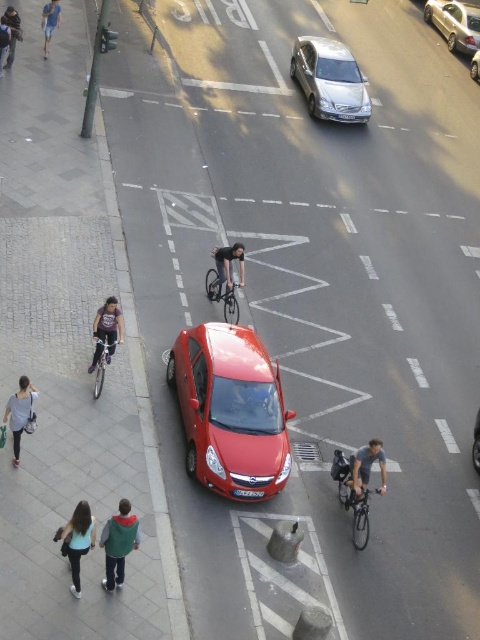
In the scene shown: Does shiny metallic bicycle at lower right lie behind metallic silver sedan at center?

No, shiny metallic bicycle at lower right is in front of metallic silver sedan at center.

Which is in front, point (370, 492) or point (470, 60)?

Positioned in front is point (370, 492).

Who is more forward, (367, 500) or (475, 65)?

Point (367, 500)

Where is `shiny metallic bicycle at lower right`? The height and width of the screenshot is (640, 480). shiny metallic bicycle at lower right is located at coordinates (358, 513).

Is point (457, 49) farther from viewer compared to point (12, 394)?

That is True.

Identify the location of silver metallic sedan at upper right. (455, 22).

Where is `silver metallic sedan at upper right`? Image resolution: width=480 pixels, height=640 pixels. silver metallic sedan at upper right is located at coordinates (455, 22).

What do you see at coordinates (119, 544) in the screenshot? I see `green fleece jacket at lower center` at bounding box center [119, 544].

Which of these two, green fleece jacket at lower center or matte black jacket at lower left, stands shorter?

matte black jacket at lower left

Is point (124, 522) behind point (14, 412)?

No, (124, 522) is closer to viewer.

Where is `green fleece jacket at lower center`? The image size is (480, 640). green fleece jacket at lower center is located at coordinates (119, 544).